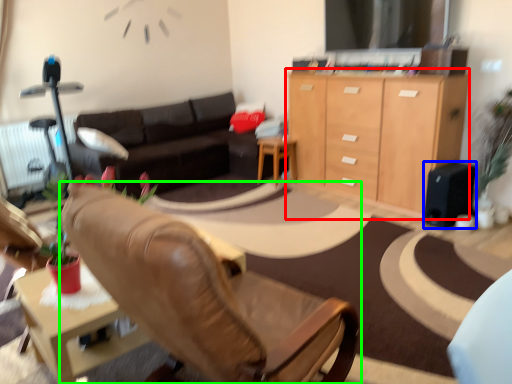
Question: Which object is the farthest from cabinetry (highlighted by a red box)? Choose among these: speaker (highlighted by a blue box) or chair (highlighted by a green box).

Choices:
 (A) speaker
 (B) chair

Answer: (B)